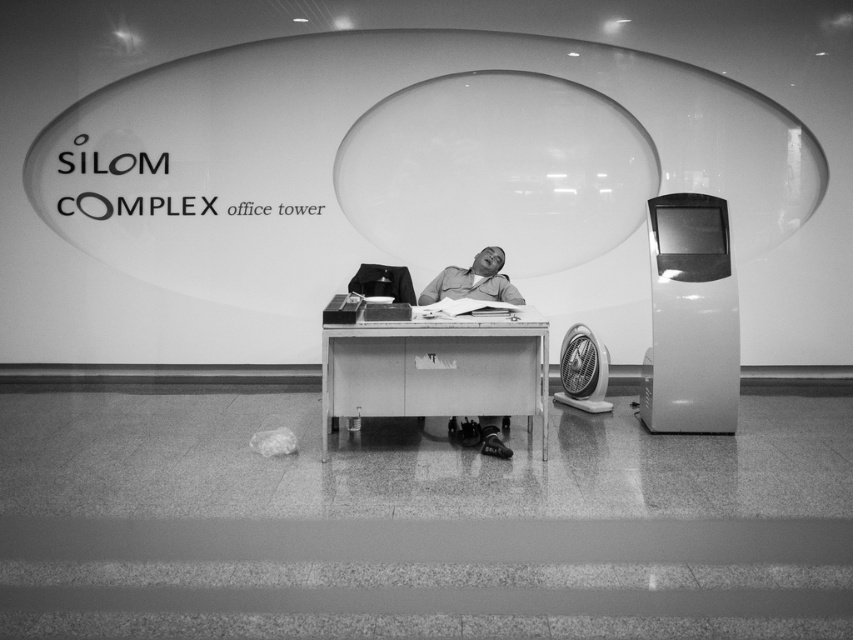
Measure the distance between metallic/smooth table at center and camera.

metallic/smooth table at center is 4.03 meters from camera.

Who is taller, metallic/smooth table at center or matte gray shirt at center?

With more height is metallic/smooth table at center.

You are a GUI agent. You are given a task and a screenshot of the screen. Output one action in this format:
    pyautogui.click(x=<x>, y=<y>)
    Task: Click on the metallic/smooth table at center
    
    Given the screenshot: What is the action you would take?
    pyautogui.click(x=436, y=365)

Which is below, transparent glass bubble at upper center or metallic/smooth table at center?

metallic/smooth table at center is lower down.

Does point (350, 132) come closer to viewer compared to point (323, 360)?

No.

Does point (546, 80) come closer to viewer compared to point (447, 301)?

No, it is behind (447, 301).

Identify the location of transparent glass bubble at upper center. (496, 170).

Between transparent glass bubble at upper center and matte gray shirt at center, which one appears on the left side from the viewer's perspective?

From the viewer's perspective, matte gray shirt at center appears more on the left side.

Between point (350, 205) and point (474, 285), which one is positioned behind?

The point (350, 205) is more distant.

Who is more forward, (x=550, y=250) or (x=473, y=420)?

Positioned in front is point (x=473, y=420).

At what (x,y) coordinates should I click in order to perform the action: click on transparent glass bubble at upper center. Please return your answer as a coordinate pair (x, y). Looking at the image, I should click on (496, 170).